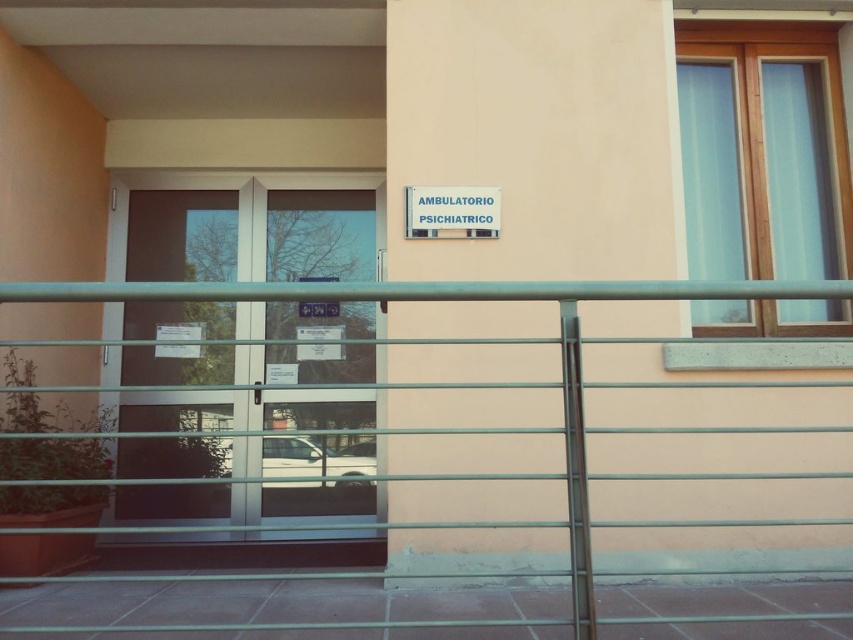
You are standing at the entrance of the ambulatory psychiatric clinic. You want to touch the point at coordinate point (320, 470). Can you reach it without moving your feet?

The point at coordinate point (320, 470) is 9.62 feet from the viewer, so you cannot reach it without moving your feet.

You are standing in front of the ambulatory psychiatric clinic entrance. There is a point at coordinate [473,300]. What object is this point located on?

The point at coordinate [473,300] is located on the metallic silver fence at center.